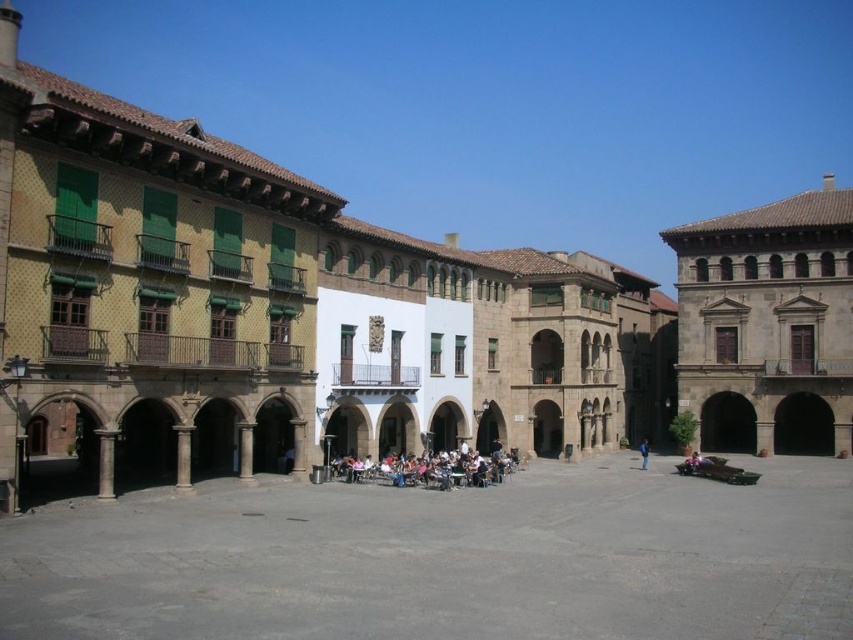
Measure the distance between stone column at center and camera.

stone column at center is 46.64 meters away from camera.

Which is in front, point (193, 428) or point (639, 449)?

Point (193, 428)

Where is `stone column at center`? The height and width of the screenshot is (640, 853). stone column at center is located at coordinates (183, 456).

Does point (33, 518) come farther from viewer compared to point (647, 452)?

No, (33, 518) is in front of (647, 452).

Can you confirm if gray stone courtyard at center is positioned to the left of blue fabric person at center?

Correct, you'll find gray stone courtyard at center to the left of blue fabric person at center.

I want to click on gray stone courtyard at center, so click(448, 560).

Is smooth stone column at left to the right of matte stone pillar at center from the viewer's perspective?

No, smooth stone column at left is not to the right of matte stone pillar at center.

Is smooth stone column at left wider than matte stone pillar at center?

Incorrect, smooth stone column at left's width does not surpass matte stone pillar at center's.

Which is behind, point (115, 429) or point (250, 426)?

Positioned behind is point (250, 426).

Where is `smooth stone column at left`? This screenshot has width=853, height=640. smooth stone column at left is located at coordinates (105, 461).